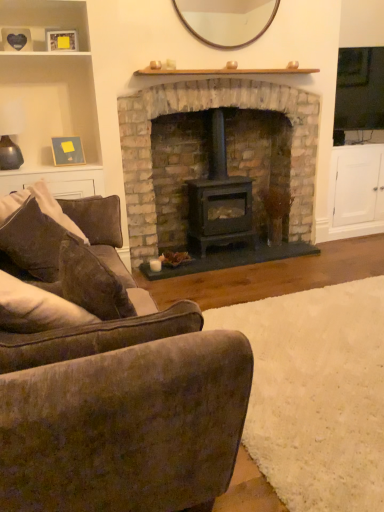
The height and width of the screenshot is (512, 384). Describe the element at coordinates (31, 244) in the screenshot. I see `brown fabric pillow at left` at that location.

Describe the element at coordinates (227, 20) in the screenshot. Image resolution: width=384 pixels, height=512 pixels. I see `wooden mirror at upper center` at that location.

Measure the distance between point (195, 191) and camera.

Point (195, 191) and camera are 3.45 meters apart.

Describe the element at coordinates (62, 40) in the screenshot. This screenshot has width=384, height=512. I see `wooden picture frame at upper left, acting as the 1th picture frame starting from the front` at that location.

The height and width of the screenshot is (512, 384). I want to click on wooden picture frame at upper left, arranged as the 2th picture frame when viewed from the back, so click(62, 40).

In order to click on brown fabric pillow at left in this screenshot , I will do `click(31, 244)`.

Consider the image. Is black matte wood burning stove at center a part of brown fabric pillow at left?

No, black matte wood burning stove at center is located outside of brown fabric pillow at left.

Is brown fabric pillow at left next to black matte wood burning stove at center and touching it?

No, brown fabric pillow at left is not making contact with black matte wood burning stove at center.

From the picture: Considering the relative sizes of brown fabric pillow at left and black matte wood burning stove at center in the image provided, is brown fabric pillow at left bigger than black matte wood burning stove at center?

Incorrect, brown fabric pillow at left is not larger than black matte wood burning stove at center.

Considering the relative positions of brown fabric pillow at left and black matte wood burning stove at center in the image provided, is brown fabric pillow at left to the left or to the right of black matte wood burning stove at center?

brown fabric pillow at left is to the left of black matte wood burning stove at center.

Is wooden picture frame at upper left, which appears as the second picture frame when ordered from the bottom, not close to velvety brown armchair at lower left?

That's right, there is a large distance between wooden picture frame at upper left, which appears as the second picture frame when ordered from the bottom, and velvety brown armchair at lower left.

Does point (69, 42) come in front of point (329, 325)?

No.

Is velvety brown armchair at lower left located within wooden picture frame at upper left, positioned as the 1th picture frame in top-to-bottom order?

No.

Is brown fabric pillow at left further to the viewer compared to wooden mirror at upper center?

No, brown fabric pillow at left is closer to the camera.

What are the coordinates of `mirror that is above the brown fabric pillow at left (from a real-world perspective)` in the screenshot? It's located at [x=227, y=20].

Is brown fabric pillow at left positioned far away from wooden mirror at upper center?

Yes, brown fabric pillow at left and wooden mirror at upper center are located far from each other.

From the picture: Considering the sizes of objects brown fabric pillow at left and wooden mirror at upper center in the image provided, who is taller, brown fabric pillow at left or wooden mirror at upper center?

With more height is brown fabric pillow at left.

Considering their positions, is velvety brown armchair at lower left located in front of or behind brown fabric couch at center?

velvety brown armchair at lower left is positioned farther from the viewer than brown fabric couch at center.

Is velvety brown armchair at lower left wider or thinner than brown fabric couch at center?

Considering their sizes, velvety brown armchair at lower left looks broader than brown fabric couch at center.

Is velvety brown armchair at lower left placed right next to brown fabric couch at center?

velvety brown armchair at lower left and brown fabric couch at center are clearly separated.

Is velvety brown armchair at lower left positioned beyond the bounds of brown fabric couch at center?

Yes, velvety brown armchair at lower left is outside of brown fabric couch at center.

Considering the relative sizes of brown fabric couch at center and stone fireplace at center in the image provided, is brown fabric couch at center bigger than stone fireplace at center?

Yes, brown fabric couch at center is bigger than stone fireplace at center.

From a real-world perspective, is brown fabric couch at center physically below stone fireplace at center?

Indeed, from a real-world perspective, brown fabric couch at center is positioned beneath stone fireplace at center.

From the picture: Based on their positions, is brown fabric couch at center located to the left or right of stone fireplace at center?

Clearly, brown fabric couch at center is on the left of stone fireplace at center in the image.

Considering the relative sizes of brown fabric couch at center and black matte wood burning stove at center in the image provided, is brown fabric couch at center taller than black matte wood burning stove at center?

No, brown fabric couch at center is not taller than black matte wood burning stove at center.

From a real-world perspective, is brown fabric couch at center located beneath black matte wood burning stove at center?

Indeed, from a real-world perspective, brown fabric couch at center is positioned beneath black matte wood burning stove at center.

From the image's perspective, which object appears higher, brown fabric couch at center or black matte wood burning stove at center?

black matte wood burning stove at center, from the image's perspective.

Which object is positioned more to the left, velvety brown armchair at lower left or wooden picture frame at upper left, the 2th picture frame viewed from the front?

Positioned to the left is wooden picture frame at upper left, the 2th picture frame viewed from the front.

The width and height of the screenshot is (384, 512). What are the coordinates of `plain that is on the right side of wooden picture frame at upper left, the first picture frame in the bottom-to-top sequence` in the screenshot? It's located at (316, 393).

Does velvety brown armchair at lower left have a greater height compared to wooden picture frame at upper left, which ranks as the second picture frame in top-to-bottom order?

Incorrect, the height of velvety brown armchair at lower left is not larger of that of wooden picture frame at upper left, which ranks as the second picture frame in top-to-bottom order.

Locate an element on the screen. pillow in front of the black matte wood burning stove at center is located at coordinates (31, 244).

Locate an element on the screen. This screenshot has width=384, height=512. plain lying below the wooden picture frame at upper left, which appears as the second picture frame when ordered from the bottom (from the image's perspective) is located at coordinates (316, 393).

Which object lies further to the anchor point wooden picture frame at upper left, acting as the 1th picture frame starting from the front, brown fabric pillow at left or brown fabric couch at center?

brown fabric couch at center lies further to wooden picture frame at upper left, acting as the 1th picture frame starting from the front, than the other object.

When comparing their distances from wooden picture frame at upper left, which ranks as the second picture frame in top-to-bottom order, does black matte wood burning stove at center or wooden picture frame at upper left, which appears as the second picture frame when ordered from the bottom, seem closer?

Among the two, wooden picture frame at upper left, which appears as the second picture frame when ordered from the bottom, is located nearer to wooden picture frame at upper left, which ranks as the second picture frame in top-to-bottom order.

From the image, which object appears to be nearer to black matte wood burning stove at center, stone fireplace at center or velvety brown armchair at lower left?

The object closer to black matte wood burning stove at center is stone fireplace at center.

Considering their positions, is wooden picture frame at upper left, which ranks as the second picture frame in top-to-bottom order, positioned closer to stone fireplace at center than brown fabric pillow at left?

wooden picture frame at upper left, which ranks as the second picture frame in top-to-bottom order.

Which object lies nearer to the anchor point wooden picture frame at upper left, acting as the 1th picture frame starting from the front, wooden mirror at upper center or stone fireplace at center?

Based on the image, wooden mirror at upper center appears to be nearer to wooden picture frame at upper left, acting as the 1th picture frame starting from the front.

When comparing their distances from wooden picture frame at upper left, arranged as the 2th picture frame when viewed from the back, does stone fireplace at center or wooden shelf at upper left seem closer?

wooden shelf at upper left is positioned closer to the anchor wooden picture frame at upper left, arranged as the 2th picture frame when viewed from the back.

Considering their positions, is wooden picture frame at upper left, positioned as the 1th picture frame in top-to-bottom order, positioned further to brown fabric pillow at left than stone fireplace at center?

Based on the image, wooden picture frame at upper left, positioned as the 1th picture frame in top-to-bottom order, appears to be further to brown fabric pillow at left.

When comparing their distances from wooden picture frame at upper left, the first picture frame in the bottom-to-top sequence, does velvety brown armchair at lower left or black matte wood burning stove at center seem closer?

Based on the image, black matte wood burning stove at center appears to be nearer to wooden picture frame at upper left, the first picture frame in the bottom-to-top sequence.

Find the location of a particular element. This screenshot has height=512, width=384. wood burning stove situated between wooden picture frame at upper left, the first picture frame in the bottom-to-top sequence, and wooden mirror at upper center from left to right is located at coordinates (219, 199).

The image size is (384, 512). Find the location of `pillow that lies between wooden shelf at upper left and velvety brown armchair at lower left from top to bottom`. pillow that lies between wooden shelf at upper left and velvety brown armchair at lower left from top to bottom is located at coordinates 31,244.

In order to click on picture frame between wooden picture frame at upper left, arranged as the 1th picture frame when viewed from the back, and velvety brown armchair at lower left in this screenshot , I will do `click(62, 40)`.

This screenshot has height=512, width=384. Identify the location of shelf between brown fabric couch at center and wooden picture frame at upper left, acting as the 1th picture frame starting from the front, in the front-back direction. (45, 19).